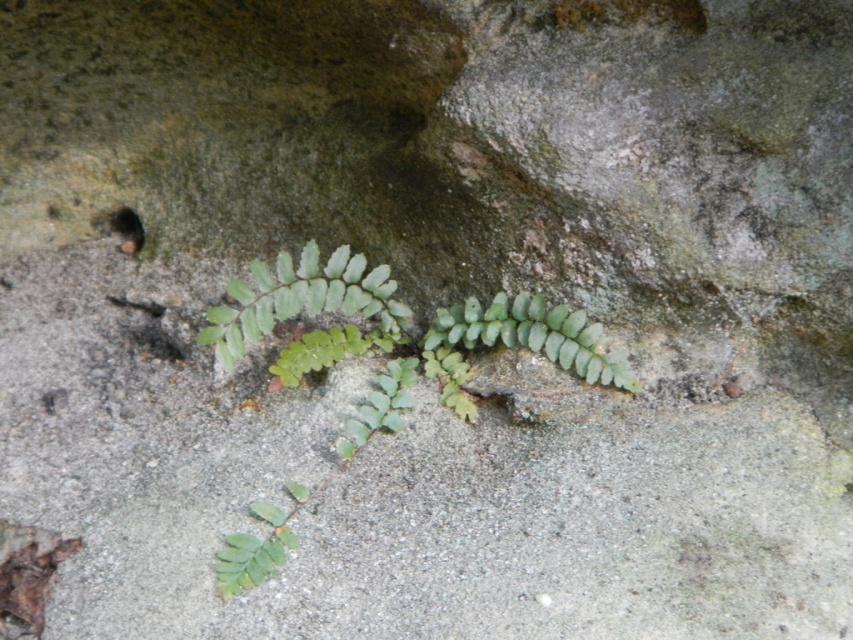
You are a hiker who wants to take a photo of the green leafy plant at center and the green leafy fern at center. Can you focus on both objects clearly in the same photo?

The green leafy plant at center is in front of the green leafy fern at center, so focusing on both might be challenging as they are at different distances from the camera.

You are standing in the natural scene and want to pick the green leafy plant at center. To your left, there is the green leafy fern at center. Which direction should you move to reach the plant?

The green leafy plant at center is to the right of the green leafy fern at center, so you should move to your right to reach it.

You are a botanist examining a natural scene with a green leafy plant at center and a green leafy fern at center. Which of the two plants is taller?

The green leafy plant at center is taller than the green leafy fern at center.